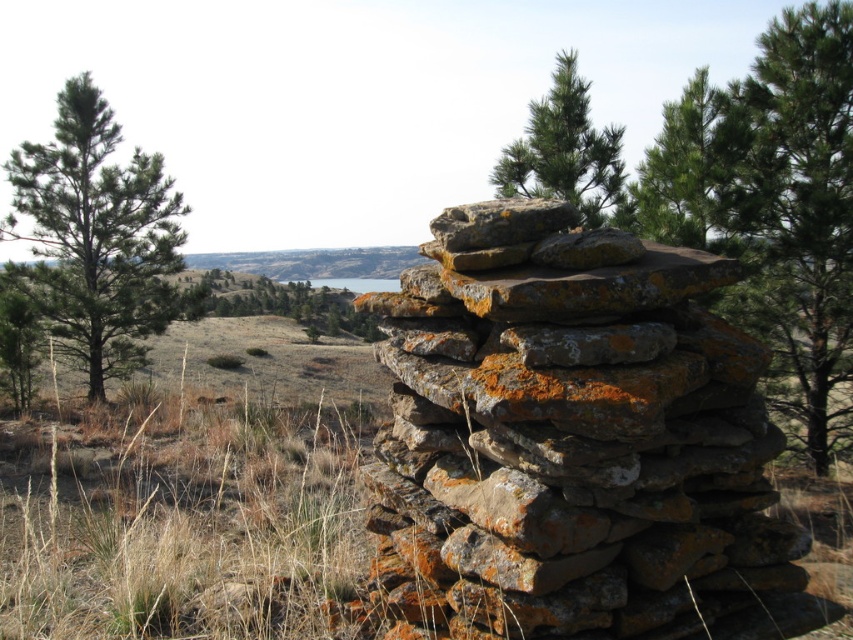
Can you confirm if green needle-like tree at right is smaller than green leafy tree at center?

Correct, green needle-like tree at right occupies less space than green leafy tree at center.

Locate an element on the screen. The height and width of the screenshot is (640, 853). green needle-like tree at right is located at coordinates (793, 216).

Find the location of a particular element. This screenshot has width=853, height=640. green needle-like tree at right is located at coordinates (793, 216).

Between brown dry grass at lower left and green rough bark tree at left, which one appears on the left side from the viewer's perspective?

green rough bark tree at left is more to the left.

Does brown dry grass at lower left have a greater height compared to green rough bark tree at left?

No.

In the scene shown: Who is more distant from viewer, (18, 605) or (138, 260)?

The point (138, 260) is more distant.

Find the location of a particular element. Image resolution: width=853 pixels, height=640 pixels. brown dry grass at lower left is located at coordinates (190, 499).

Which is above, brown dry grass at lower left or green lichen-covered rock at upper center?

green lichen-covered rock at upper center is above.

Is brown dry grass at lower left shorter than green lichen-covered rock at upper center?

Indeed, brown dry grass at lower left has a lesser height compared to green lichen-covered rock at upper center.

What do you see at coordinates (190, 499) in the screenshot?
I see `brown dry grass at lower left` at bounding box center [190, 499].

Locate an element on the screen. This screenshot has height=640, width=853. brown dry grass at lower left is located at coordinates (190, 499).